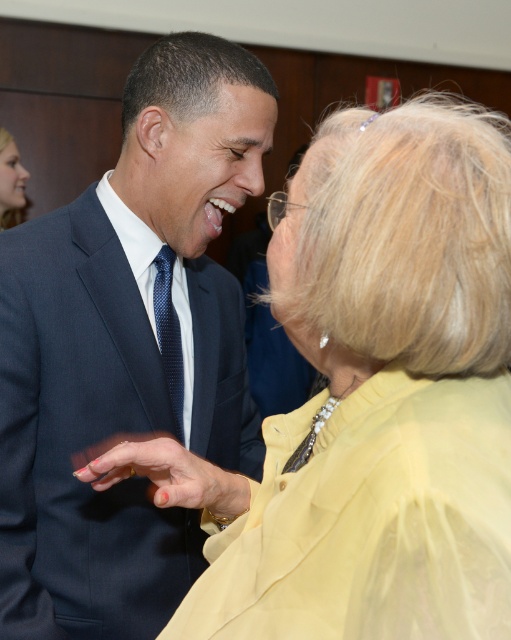
Can you confirm if yellow satin blouse at center is shorter than blue dotted tie at center?

In fact, yellow satin blouse at center may be taller than blue dotted tie at center.

Who is more forward, (206,614) or (180,369)?

Point (206,614) is in front.

The height and width of the screenshot is (640, 511). What are the coordinates of `yellow satin blouse at center` in the screenshot? It's located at (369, 397).

Identify the location of yellow satin blouse at center. (369, 397).

Is matte black suit at center shorter than blue dotted tie at center?

No, matte black suit at center is not shorter than blue dotted tie at center.

Does matte black suit at center appear on the right side of blue dotted tie at center?

Correct, you'll find matte black suit at center to the right of blue dotted tie at center.

Is point (169, 131) closer to viewer compared to point (161, 275)?

Yes, it is in front of point (161, 275).

Locate an element on the screen. matte black suit at center is located at coordinates (127, 349).

Is yellow satin blouse at center behind matte black suit at center?

No, yellow satin blouse at center is closer to the viewer.

Is yellow satin blouse at center positioned before matte black suit at center?

Yes, it is in front of matte black suit at center.

Between point (285, 465) and point (90, 364), which one is positioned in front?

Point (285, 465) is more forward.

Where is `yellow satin blouse at center`? yellow satin blouse at center is located at coordinates (369, 397).